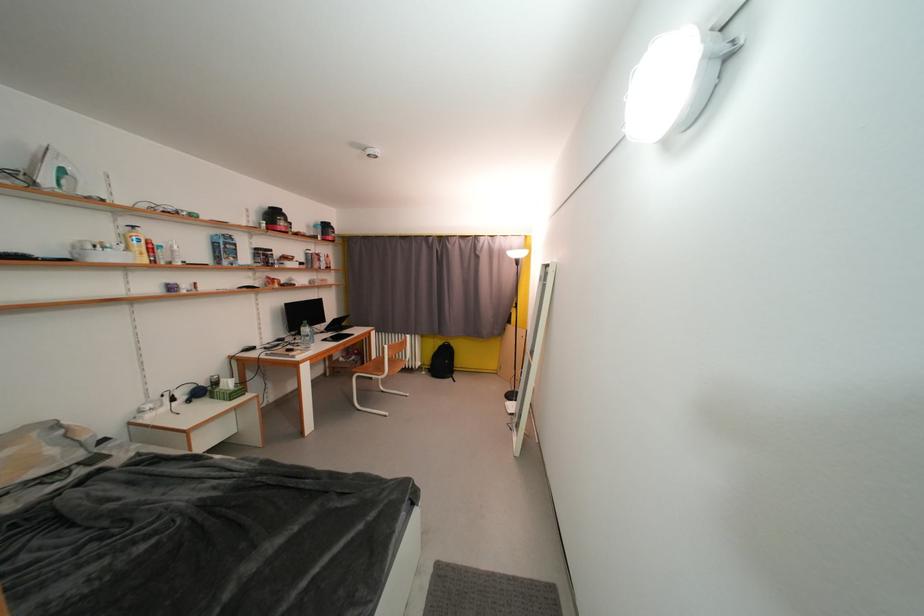
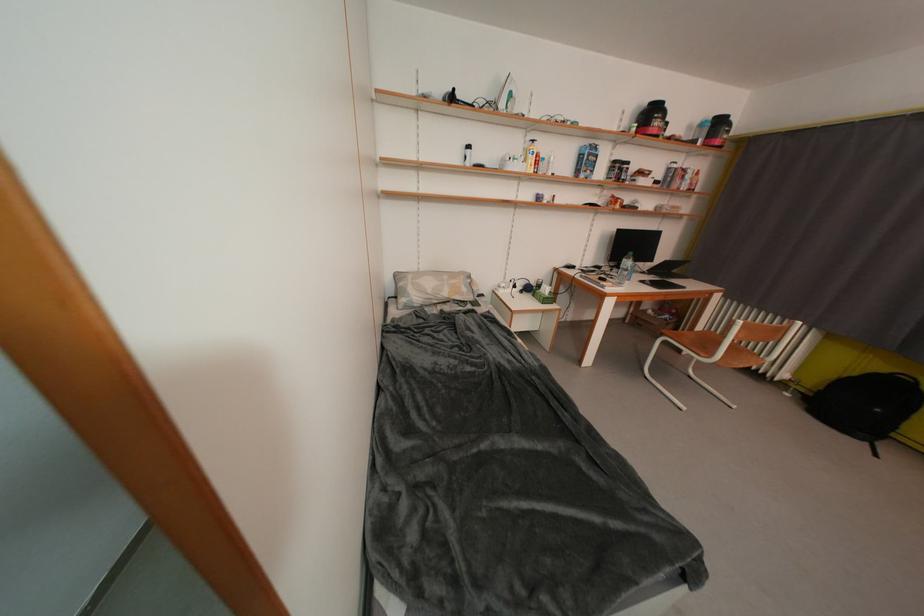
Locate, in the second image, the point that corresponds to point (292, 233) in the first image.

(663, 136)